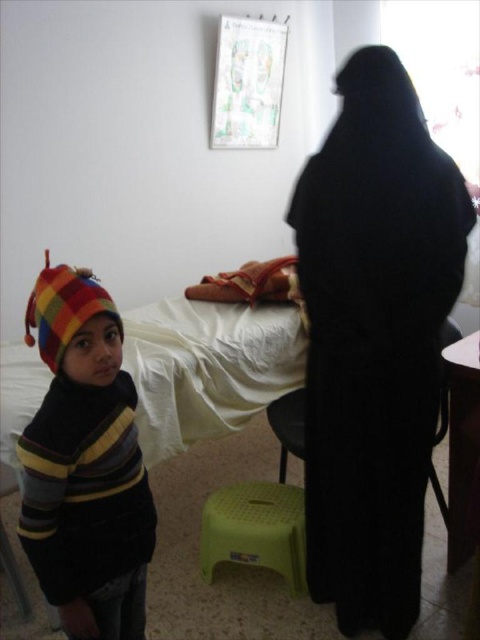
At what (x,y) coordinates should I click in order to perform the action: click on white soft bed at center. Please return your answer as a coordinate pair (x, y). The height and width of the screenshot is (640, 480). Looking at the image, I should click on (207, 368).

Who is lower down, white soft bed at center or green plastic stool at lower center?

green plastic stool at lower center

Which is in front, point (228, 420) or point (229, 516)?

Point (229, 516) is more forward.

At what (x,y) coordinates should I click in order to perform the action: click on white soft bed at center. Please return your answer as a coordinate pair (x, y). The image size is (480, 640). Looking at the image, I should click on (207, 368).

Does striped woolen sweater at left have a greater width compared to black plastic chair at lower center?

Indeed, striped woolen sweater at left has a greater width compared to black plastic chair at lower center.

Is striped woolen sweater at left smaller than black plastic chair at lower center?

No, striped woolen sweater at left is not smaller than black plastic chair at lower center.

Does point (46, 483) come behind point (282, 440)?

No, (46, 483) is closer to viewer.

At what (x,y) coordinates should I click in order to perform the action: click on striped woolen sweater at left. Please return your answer as a coordinate pair (x, y). Looking at the image, I should click on (84, 465).

Is black matte dress at right taller than black plastic chair at lower center?

Indeed, black matte dress at right has a greater height compared to black plastic chair at lower center.

Where is `black matte dress at right`? Image resolution: width=480 pixels, height=640 pixels. black matte dress at right is located at coordinates (373, 339).